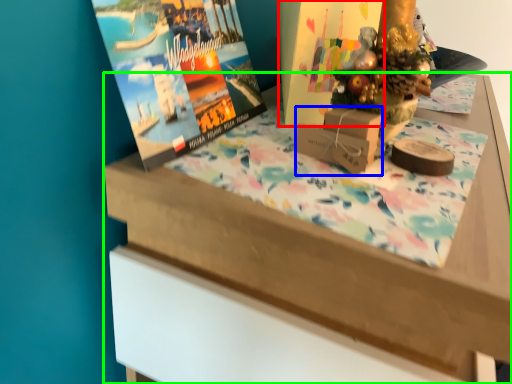
Question: Which object is the closest to the book cover (highlighted by a red box)? Choose among these: cardboard box (highlighted by a blue box) or table (highlighted by a green box).

Choices:
 (A) cardboard box
 (B) table

Answer: (A)